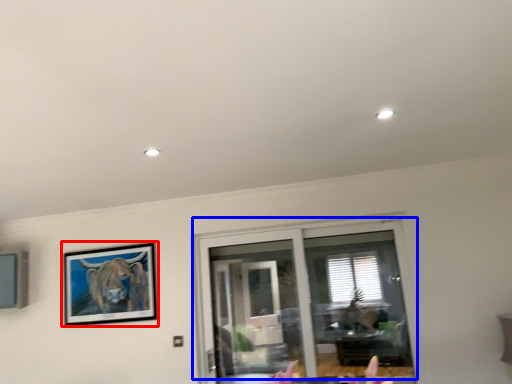
Question: Among these objects, which one is farthest to the camera, picture frame (highlighted by a red box) or window (highlighted by a blue box)?

Choices:
 (A) picture frame
 (B) window

Answer: (A)